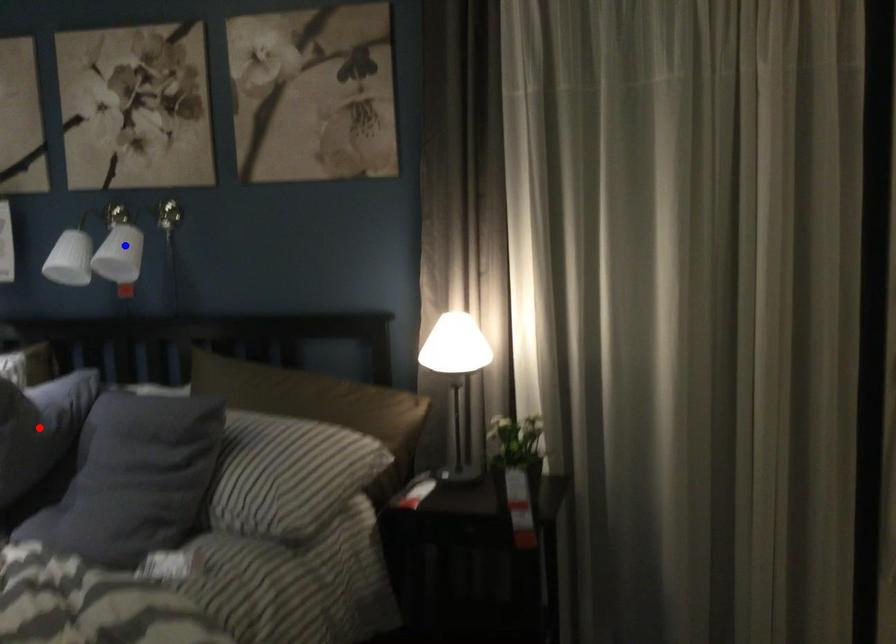
Question: In the image, two points are highlighted. Which point is nearer to the camera? Reply with the corresponding letter.

Choices:
 (A) blue point
 (B) red point

Answer: (B)